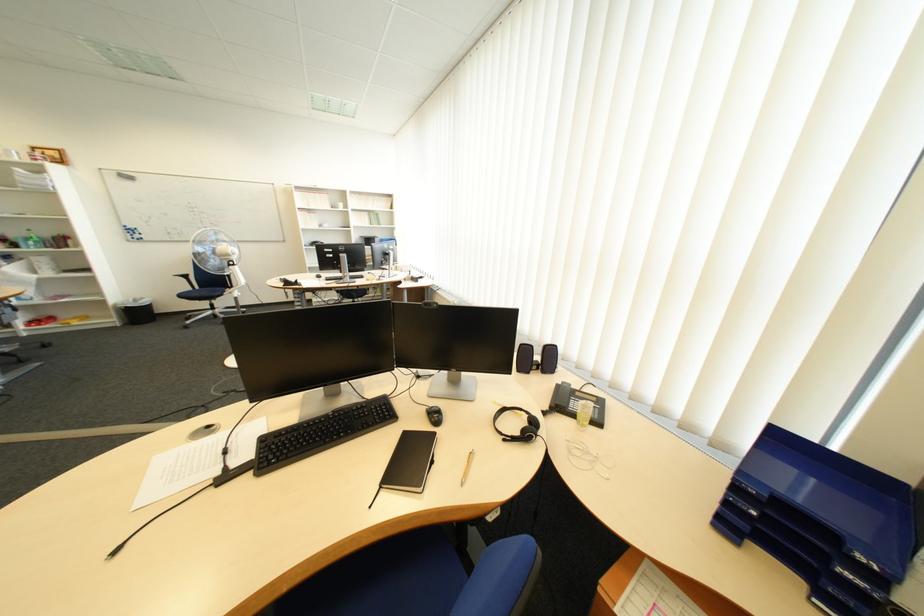
What do you see at coordinates (511, 564) in the screenshot? This screenshot has width=924, height=616. I see `the blue chair armrest` at bounding box center [511, 564].